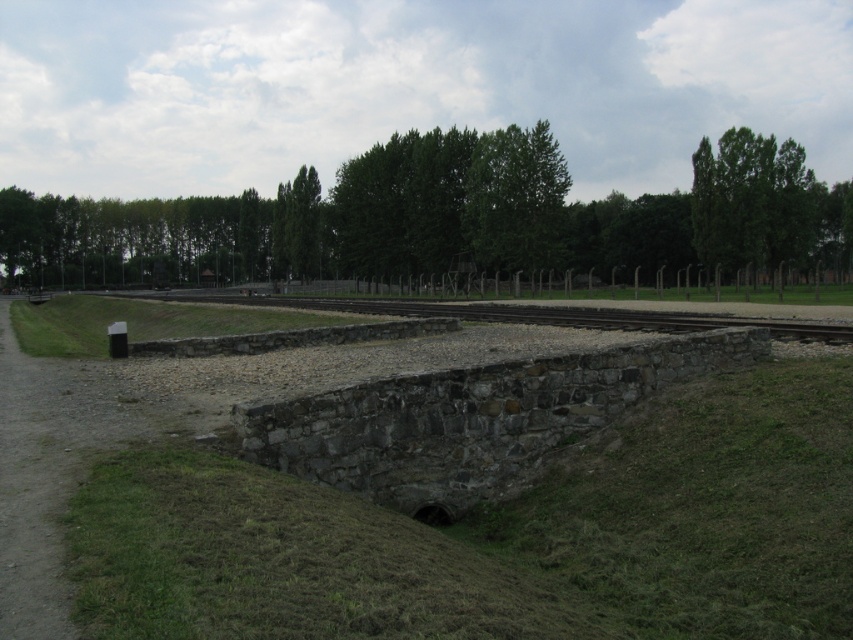
Does gray stone bridge at center lie in front of green leafy trees at upper center?

Yes, gray stone bridge at center is closer to the viewer.

Is gray stone bridge at center shorter than green leafy trees at upper center?

Yes, gray stone bridge at center is shorter than green leafy trees at upper center.

Identify the location of gray stone bridge at center. (242, 508).

The width and height of the screenshot is (853, 640). Identify the location of gray stone bridge at center. (242, 508).

Which of these two, gray stone bridge at center or green leafy tree at upper right, stands taller?

Standing taller between the two is green leafy tree at upper right.

Which is in front, point (581, 600) or point (802, 173)?

Point (581, 600) is in front.

Does point (459, 352) come behind point (711, 220)?

No.

Image resolution: width=853 pixels, height=640 pixels. Find the location of `gray stone bridge at center`. gray stone bridge at center is located at coordinates (242, 508).

Between green leafy trees at upper center and green leafy tree at upper right, which one is positioned lower?

green leafy trees at upper center is lower down.

Is green leafy trees at upper center in front of green leafy tree at upper right?

No, it is behind green leafy tree at upper right.

The width and height of the screenshot is (853, 640). Describe the element at coordinates (445, 218) in the screenshot. I see `green leafy trees at upper center` at that location.

Identify the location of green leafy trees at upper center. (445, 218).